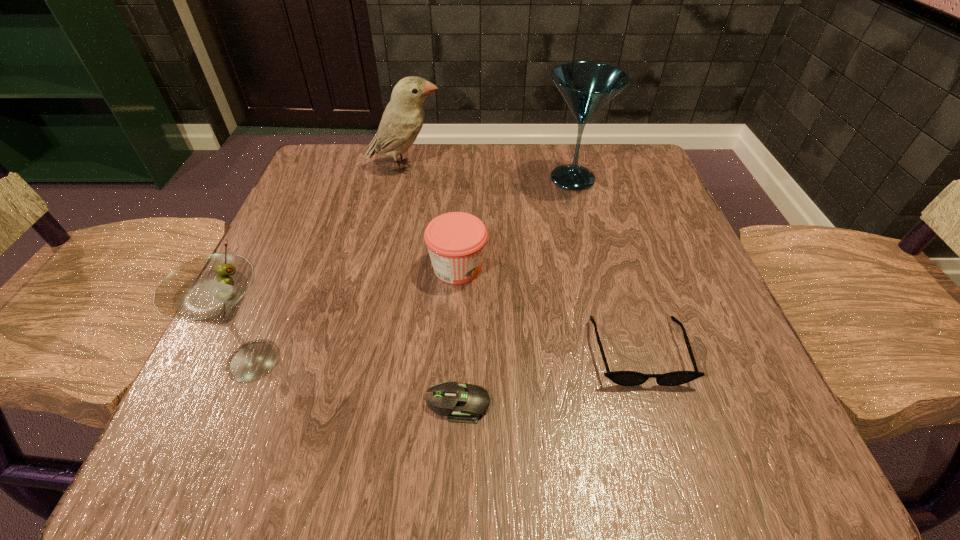
Where is `the taller martini`? This screenshot has width=960, height=540. the taller martini is located at coordinates (586, 86).

I want to click on the right martini, so click(586, 86).

Locate an element on the screen. The width and height of the screenshot is (960, 540). bird is located at coordinates (402, 120).

This screenshot has height=540, width=960. I want to click on the nearer martini, so click(x=210, y=289).

Image resolution: width=960 pixels, height=540 pixels. Identify the location of the leftmost object. (210, 289).

The image size is (960, 540). What are the coordinates of `the third shortest object` in the screenshot? It's located at (456, 241).

This screenshot has width=960, height=540. I want to click on the fourth nearest object, so click(x=456, y=241).

At what (x,y) coordinates should I click in order to perform the action: click on sunglasses. Please return your answer as a coordinate pair (x, y). The height and width of the screenshot is (540, 960). Looking at the image, I should click on (624, 378).

I want to click on computer mouse, so click(464, 403).

You are a GUI agent. You are given a task and a screenshot of the screen. Output one action in this format:
    pyautogui.click(x=<x>, y=<y>)
    Task: Click on the vacant area located 0.220m on the left of the farther martini
    The width and height of the screenshot is (960, 540).
    Given the screenshot: What is the action you would take?
    pyautogui.click(x=440, y=179)